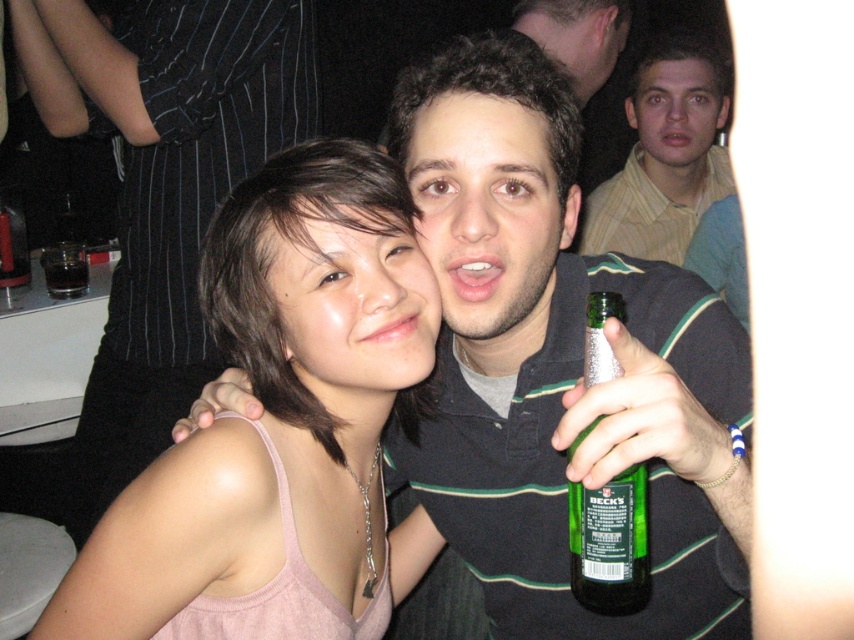
You are a photographer at the event and need to capture a closeup of the green glass bottle at center without the yellow striped shirt at upper right appearing in the shot. Is this possible based on their positions?

The yellow striped shirt at upper right is positioned on the right side of green glass bottle at center. To avoid including the yellow striped shirt at upper right in the photo, the photographer should adjust the camera angle to frame the green glass bottle at center while excluding the right side where the yellow striped shirt at upper right is located.

From the picture: You are a photographer at the scene and want to capture a closeup of the pink fabric tank top at center and the green glass bottle at center. Which object should you zoom in on first to ensure it fits better in the frame?

The pink fabric tank top at center is bigger than the green glass bottle at center, so you should zoom in on the pink fabric tank top at center first to ensure it fits better in the frame.